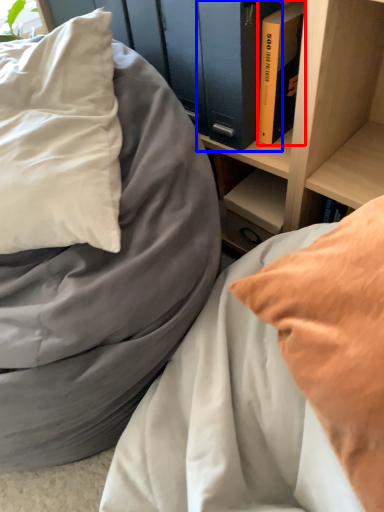
Question: Among these objects, which one is nearest to the camera, book (highlighted by a red box) or paperback book (highlighted by a blue box)?

Choices:
 (A) book
 (B) paperback book

Answer: (B)